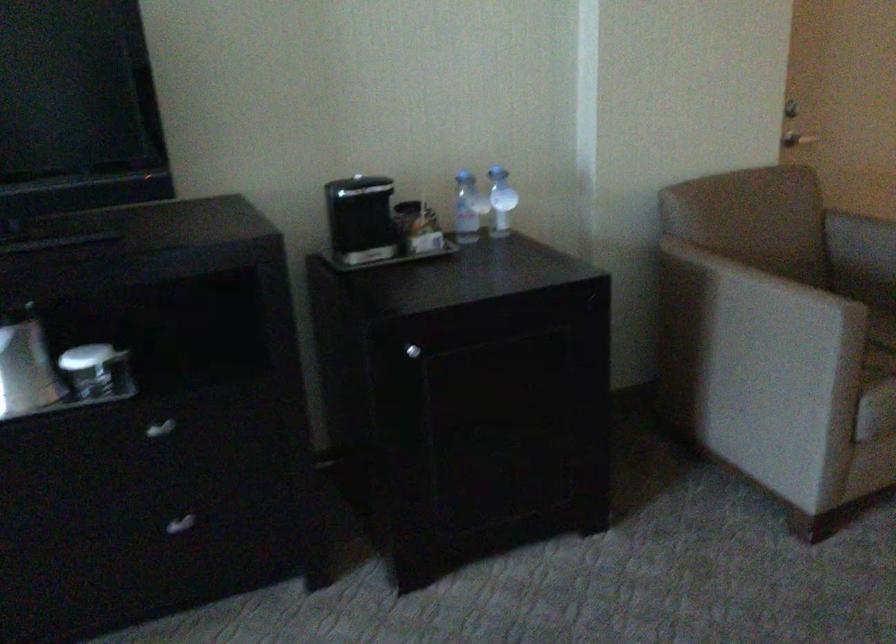
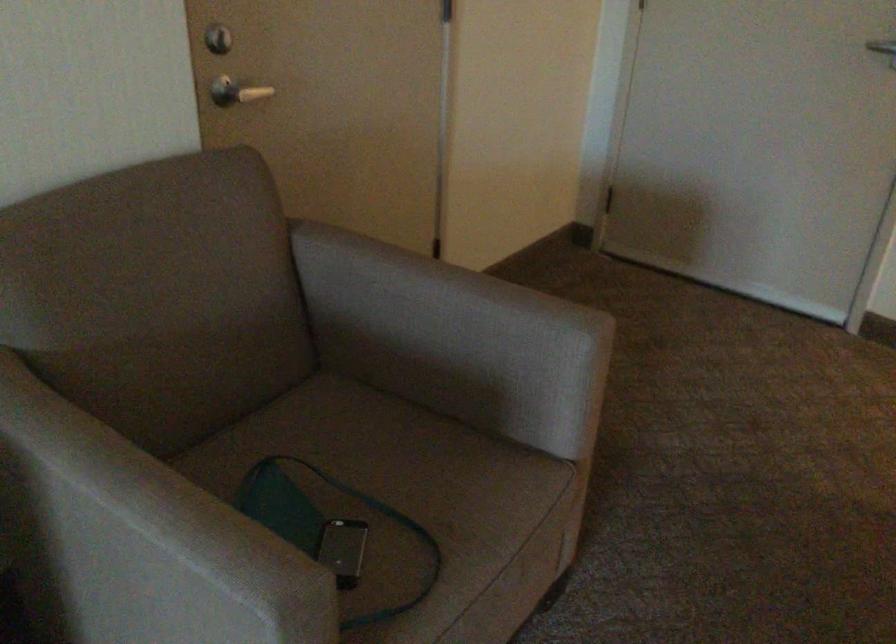
Locate, in the second image, the point that corresponds to (x=810, y=124) in the first image.

(236, 91)